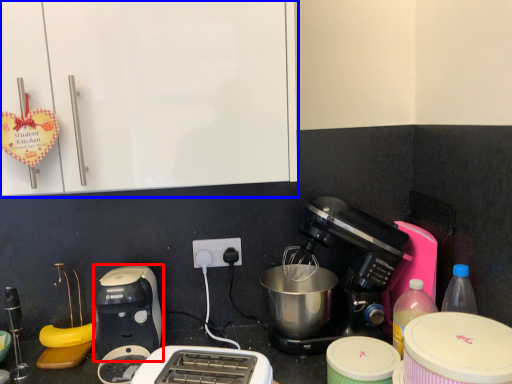
Question: Which point is further to the camera, toaster (highlighted by a red box) or cabinetry (highlighted by a blue box)?

Choices:
 (A) toaster
 (B) cabinetry

Answer: (A)